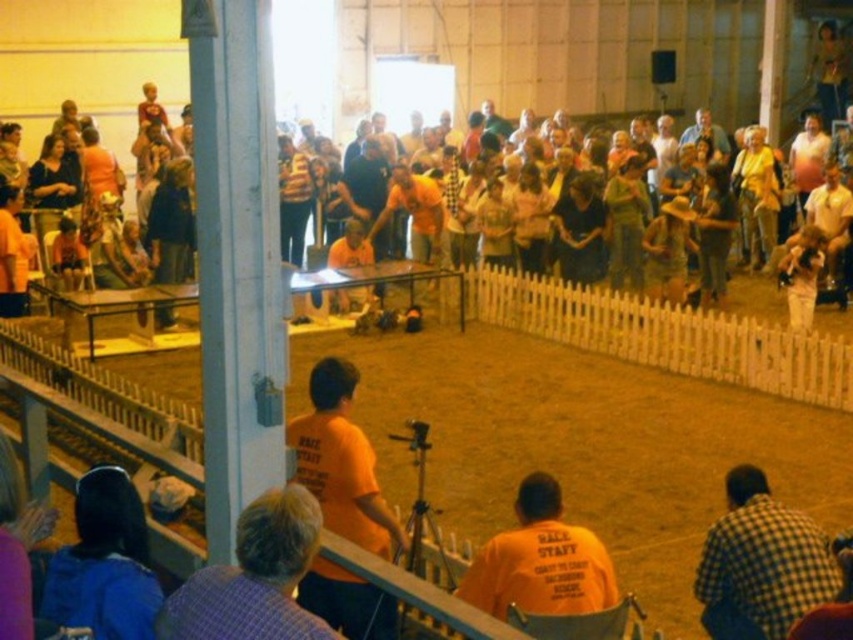
Is blue fabric at lower left below orange shirted people at center?

Yes, blue fabric at lower left is below orange shirted people at center.

The height and width of the screenshot is (640, 853). Describe the element at coordinates (103, 563) in the screenshot. I see `blue fabric at lower left` at that location.

Describe the element at coordinates (103, 563) in the screenshot. I see `blue fabric at lower left` at that location.

Where is `blue fabric at lower left`? blue fabric at lower left is located at coordinates (103, 563).

Is blue plaid shirt at lower left to the left of orange shirted people at center from the viewer's perspective?

Correct, you'll find blue plaid shirt at lower left to the left of orange shirted people at center.

Who is positioned more to the left, blue plaid shirt at lower left or orange shirted people at center?

blue plaid shirt at lower left is more to the left.

Is point (202, 572) less distant than point (189, 141)?

Yes, it is.

In order to click on blue plaid shirt at lower left in this screenshot , I will do `click(253, 577)`.

Is checkered fabric shirt at lower right wider than blue plaid shirt at lower left?

Yes, checkered fabric shirt at lower right is wider than blue plaid shirt at lower left.

Does checkered fabric shirt at lower right appear under blue plaid shirt at lower left?

Correct, checkered fabric shirt at lower right is located below blue plaid shirt at lower left.

Does point (744, 509) lie behind point (206, 572)?

Yes, it is behind point (206, 572).

Find the location of a particular element. checkered fabric shirt at lower right is located at coordinates [761, 563].